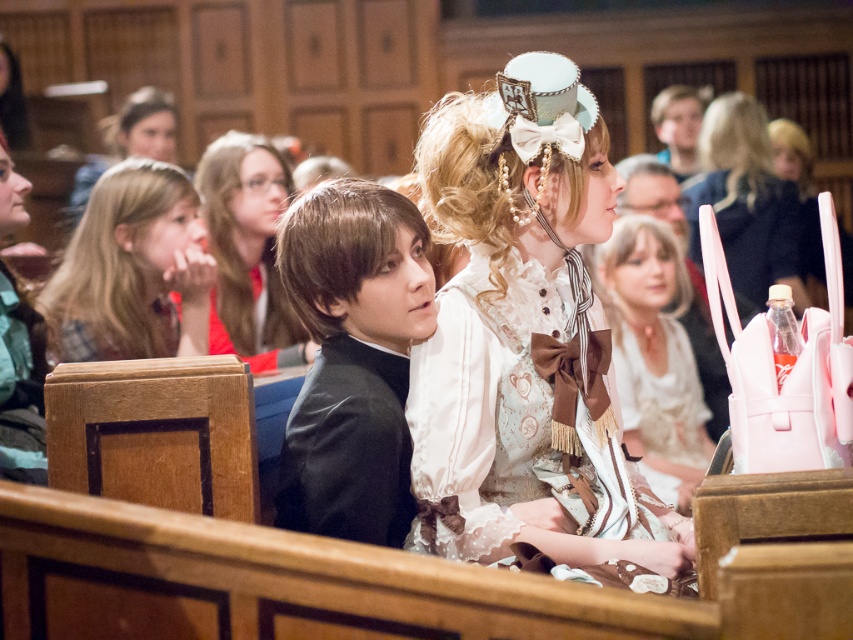
You are organizing a photo shoot in the scene described. You need to place a spotlight at position point 0.562, 0.415 to highlight the black satin suit at center. Is there any object in the way of the spotlight beam if it is directed towards that point?

The black satin suit at center is located at point (352, 358), so the spotlight beam directed towards that point would directly hit the black satin suit at center without any obstruction mentioned in the scene description.

You are organizing a costume party and need to ensure that all black accessories are placed on a shelf. The shelf can only hold items smaller than the matte black hairband at upper left. Can the black satin suit at center be placed on the shelf?

The black satin suit at center is smaller than the matte black hairband at upper left, so it can be placed on the shelf since it meets the size requirement.

You are attending a themed event and want to take a photo of both the white lace dress at center and the matte black dress at center. Since you can only focus on one at a time, which dress should you focus on to ensure the other is still visible in the background?

You should focus on the white lace dress at center because it is in front of the matte black dress at center, so if you focus on the front dress, the one behind will still be visible in the background.